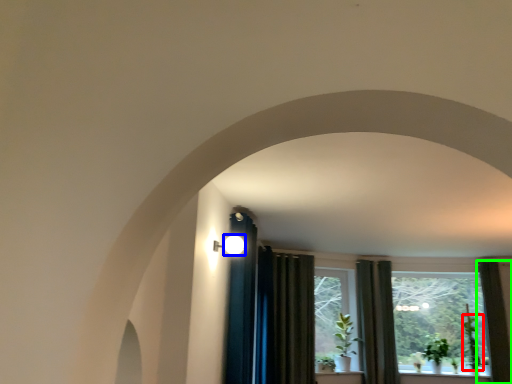
Question: Based on their relative distances, which object is nearer to plant (highlighted by a red box)? Choose from light (highlighted by a blue box) and curtain (highlighted by a green box).

Choices:
 (A) light
 (B) curtain

Answer: (B)